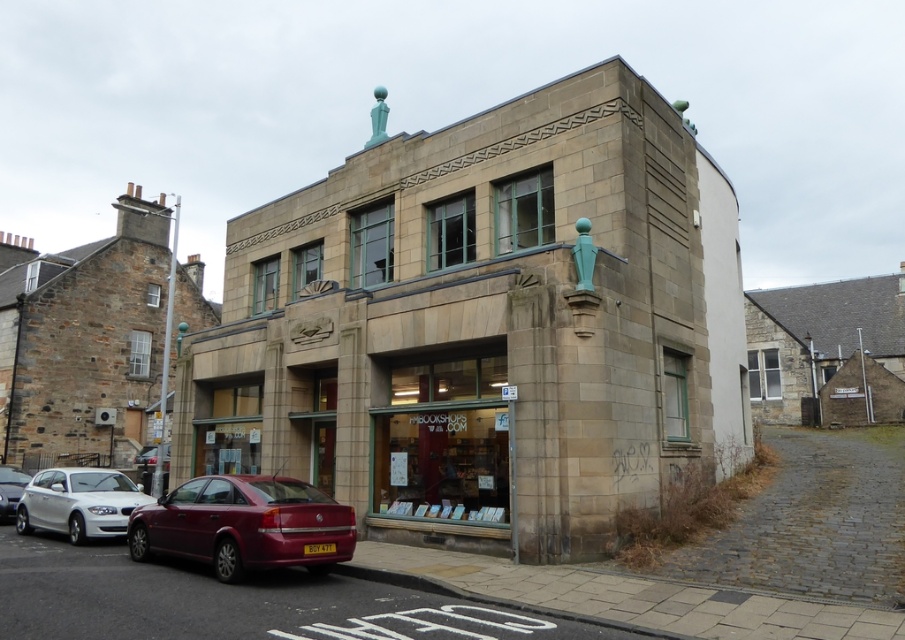
Question: Considering the relative positions of white matte car at lower left and white glossy sedan at lower left in the image provided, where is white matte car at lower left located with respect to white glossy sedan at lower left?

Choices:
 (A) left
 (B) right

Answer: (A)

Question: Which of the following is the closest to the observer?

Choices:
 (A) white glossy sedan at lower left
 (B) shiny red sedan at lower left
 (C) stone building at center

Answer: (B)

Question: Which point is closer to the camera?

Choices:
 (A) (253, 476)
 (B) (2, 506)
 (C) (322, 340)

Answer: (A)

Question: Does shiny red sedan at lower left have a lesser width compared to white glossy sedan at lower left?

Choices:
 (A) yes
 (B) no

Answer: (B)

Question: Can you confirm if stone building at center is positioned to the right of shiny red sedan at lower left?

Choices:
 (A) no
 (B) yes

Answer: (B)

Question: Which point is farther to the camera?

Choices:
 (A) shiny red sedan at lower left
 (B) stone building at center

Answer: (B)